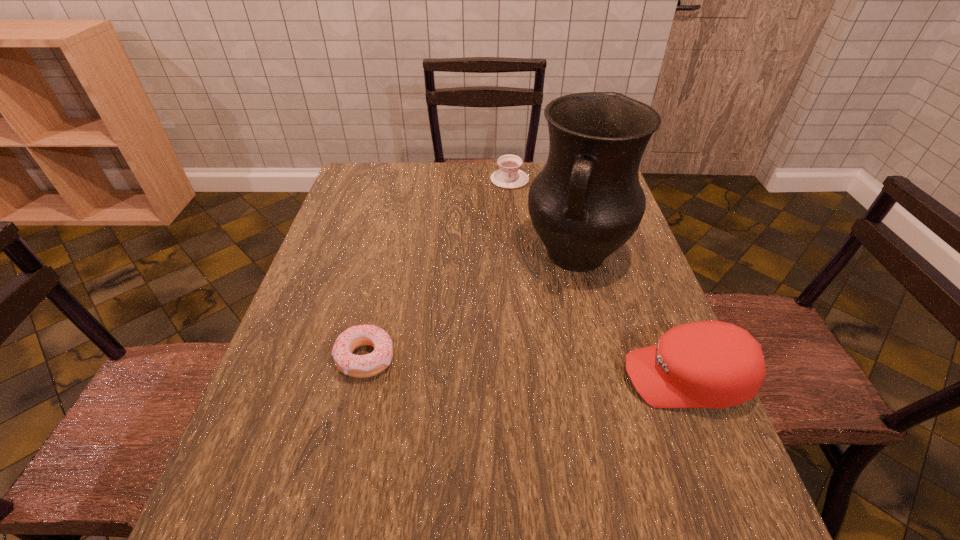
Where is `vacant space situated on the front-facing side of the second tallest object`? Image resolution: width=960 pixels, height=540 pixels. vacant space situated on the front-facing side of the second tallest object is located at coordinates [x=437, y=378].

Identify the location of vacant space located 0.280m on the handle side of the tallest object. This screenshot has width=960, height=540. (528, 377).

Find the location of a particular element. This screenshot has width=960, height=540. vacant point located on the handle side of the tallest object is located at coordinates pyautogui.click(x=529, y=373).

Locate an element on the screen. The width and height of the screenshot is (960, 540). vacant space situated on the handle side of the tallest object is located at coordinates (552, 318).

Where is `free space located 0.180m on the handle side of the teacup`? The width and height of the screenshot is (960, 540). free space located 0.180m on the handle side of the teacup is located at coordinates (511, 222).

This screenshot has height=540, width=960. In order to click on vacant space situated 0.070m on the handle side of the teacup in this screenshot , I will do tap(510, 201).

Find the location of a particular element. This screenshot has width=960, height=540. free region located on the handle side of the teacup is located at coordinates (510, 218).

Where is `object at the far edge`? Image resolution: width=960 pixels, height=540 pixels. object at the far edge is located at coordinates click(509, 176).

Find the location of a particular element. object at the left edge is located at coordinates (359, 366).

Find the location of a particular element. The image size is (960, 540). cap that is at the right edge is located at coordinates (707, 364).